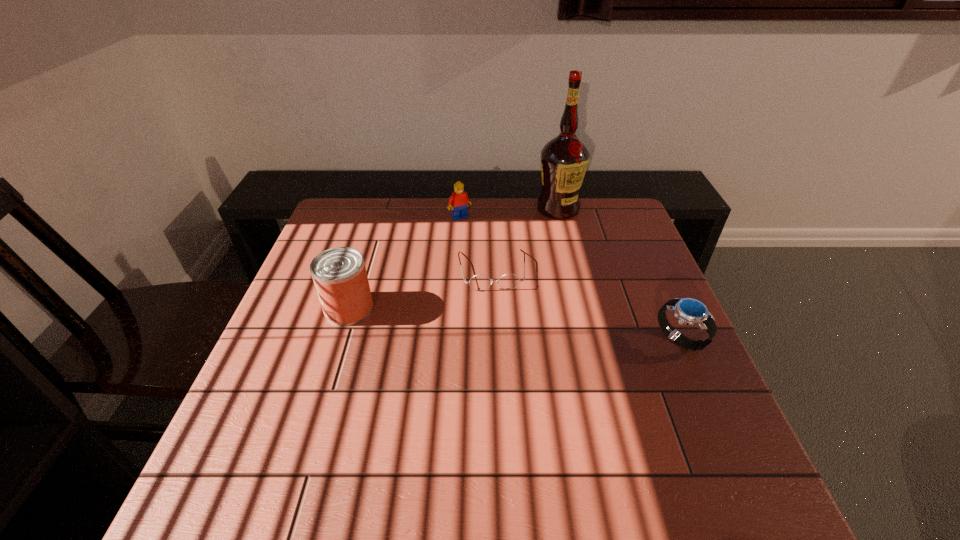
What are the coordinates of `vacant region at the near left corner of the desktop` in the screenshot? It's located at (225, 436).

Find the location of a particular element. vacant space at the far right corner is located at coordinates (631, 219).

Locate an element on the screen. empty space that is in between the third shortest object and the tallest object is located at coordinates (509, 213).

What are the coordinates of `vacant region between the second shortest object and the can` in the screenshot? It's located at (515, 324).

You are a GUI agent. You are given a task and a screenshot of the screen. Output one action in this format:
    pyautogui.click(x=<x>, y=<y>)
    Task: Click on the free spot between the third farthest object and the fourth tallest object
    This screenshot has width=960, height=540.
    Given the screenshot: What is the action you would take?
    pyautogui.click(x=586, y=305)

What are the coordinates of `vacant space that is in between the alcohol and the fourth tallest object` in the screenshot? It's located at (618, 274).

You are a GUI agent. You are given a task and a screenshot of the screen. Output one action in this format:
    pyautogui.click(x=<x>, y=<y>)
    Task: Click on the free area in between the Lego and the shortest object
    Image resolution: width=960 pixels, height=540 pixels.
    Given the screenshot: What is the action you would take?
    pyautogui.click(x=475, y=244)

Locate an element on the screen. empty space between the fourth tallest object and the second object from right to left is located at coordinates (618, 274).

The width and height of the screenshot is (960, 540). I want to click on unoccupied area between the spectacles and the Lego, so point(475,244).

Identify the location of unoccupied position between the spectacles and the Lego. (475, 244).